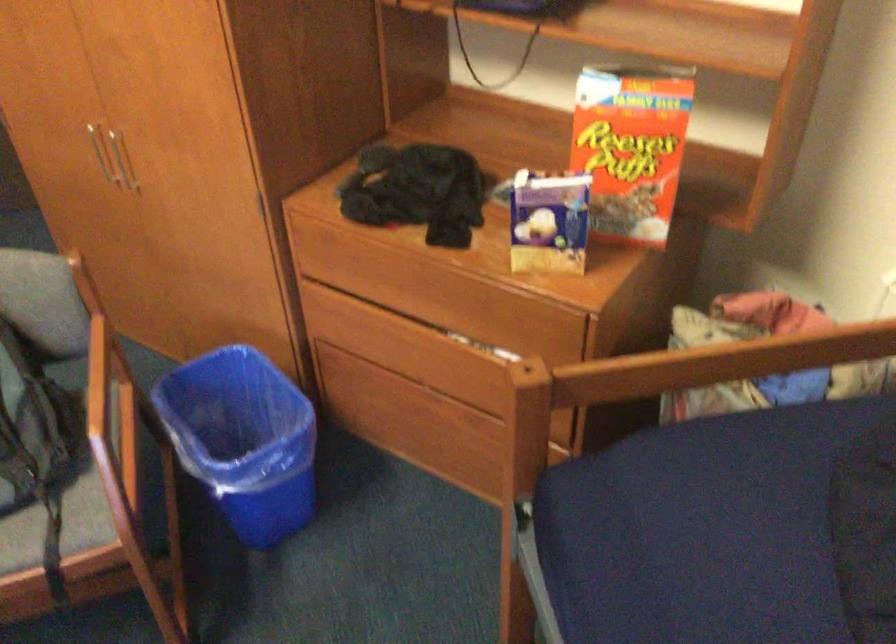
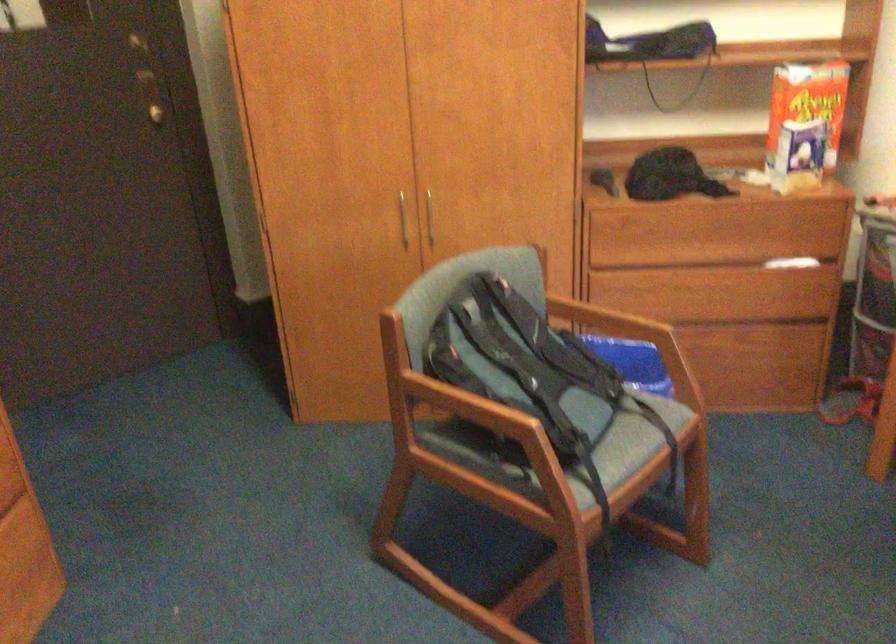
Question: I am providing you with two images of the same scene from different viewpoints. Please identify which objects are invisible in image2.

Choices:
 (A) red valve lever
 (B) drawer recessed pull
 (C) blue trash can
 (D) wooden chair armrest

Answer: (C)